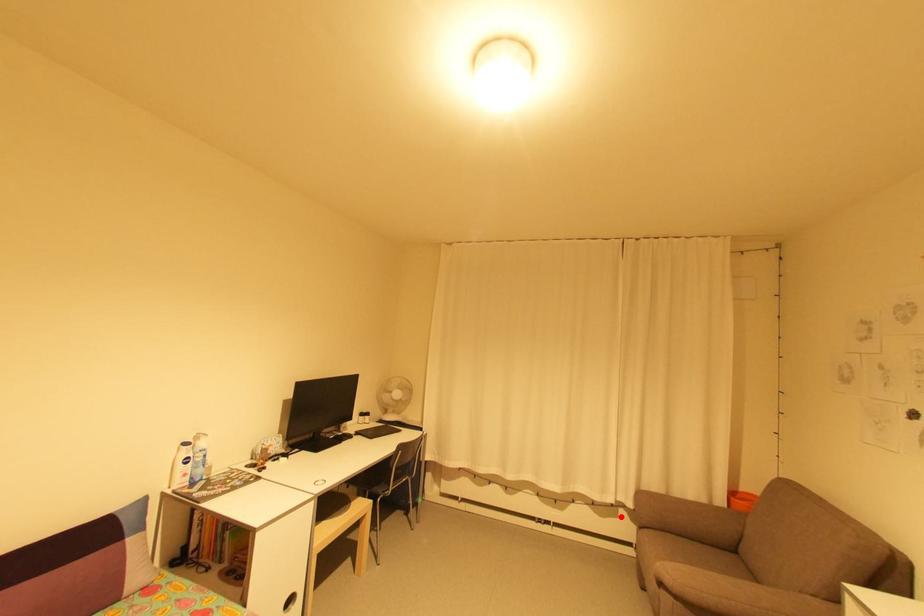
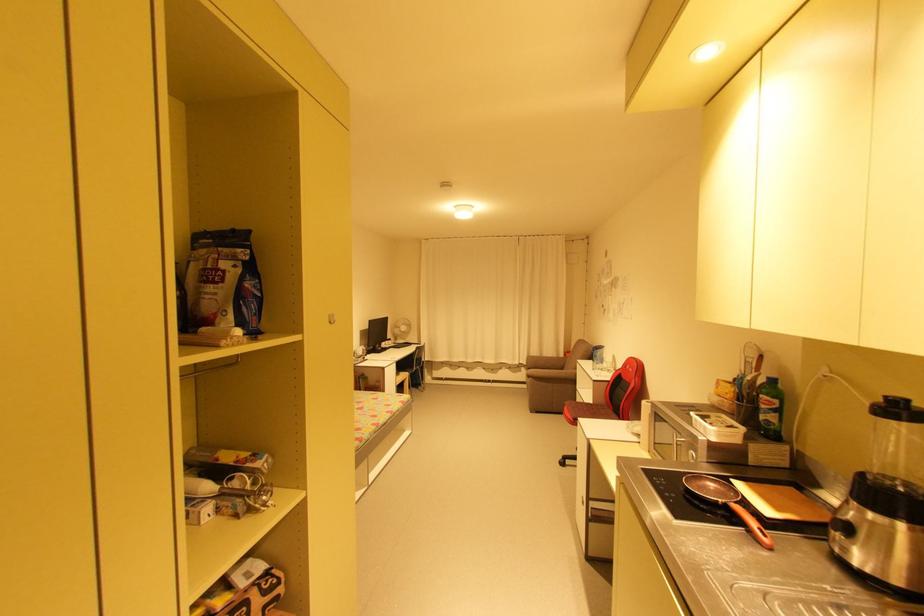
Where in the second image is the point corresponding to the highlighted location from the first image?

(525, 371)